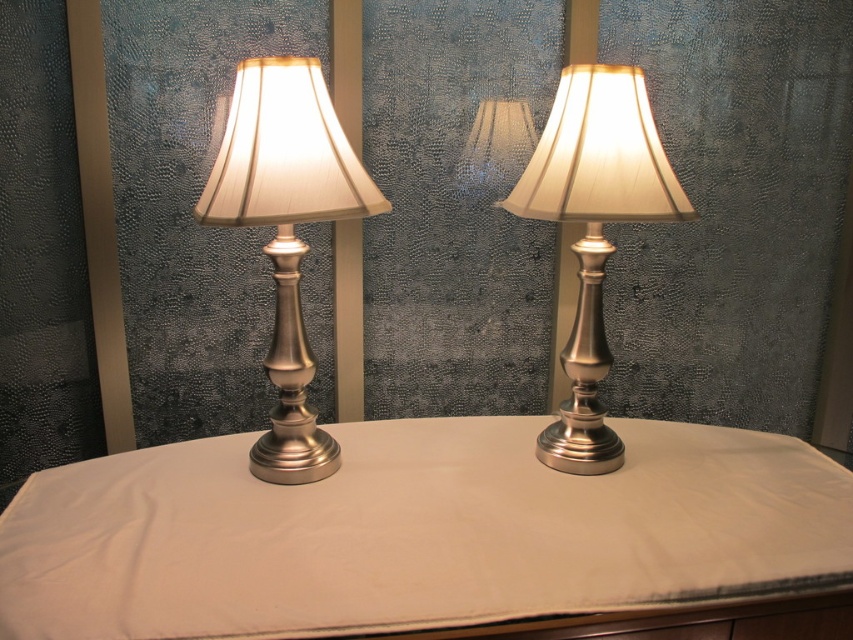
Between white fabric table at center and satin silver table lamp at left, which one is positioned higher?

Positioned higher is satin silver table lamp at left.

Is white fabric table at center smaller than satin silver table lamp at left?

Incorrect, white fabric table at center is not smaller in size than satin silver table lamp at left.

Measure the distance between white fabric table at center and camera.

white fabric table at center is 35.72 inches away from camera.

Identify the location of white fabric table at center. The width and height of the screenshot is (853, 640). (415, 532).

Does satin silver table lamp at left appear on the left side of brushed metal table lamp at center?

Correct, you'll find satin silver table lamp at left to the left of brushed metal table lamp at center.

Which is in front, point (207, 211) or point (517, 193)?

Point (207, 211) is more forward.

Locate an element on the screen. The width and height of the screenshot is (853, 640). satin silver table lamp at left is located at coordinates (286, 230).

Who is taller, white fabric table at center or brushed metal table lamp at center?

With more height is brushed metal table lamp at center.

Does white fabric table at center come behind brushed metal table lamp at center?

No.

Is point (614, 474) positioned in front of point (657, 188)?

No, it is not.

Image resolution: width=853 pixels, height=640 pixels. I want to click on white fabric table at center, so point(415,532).